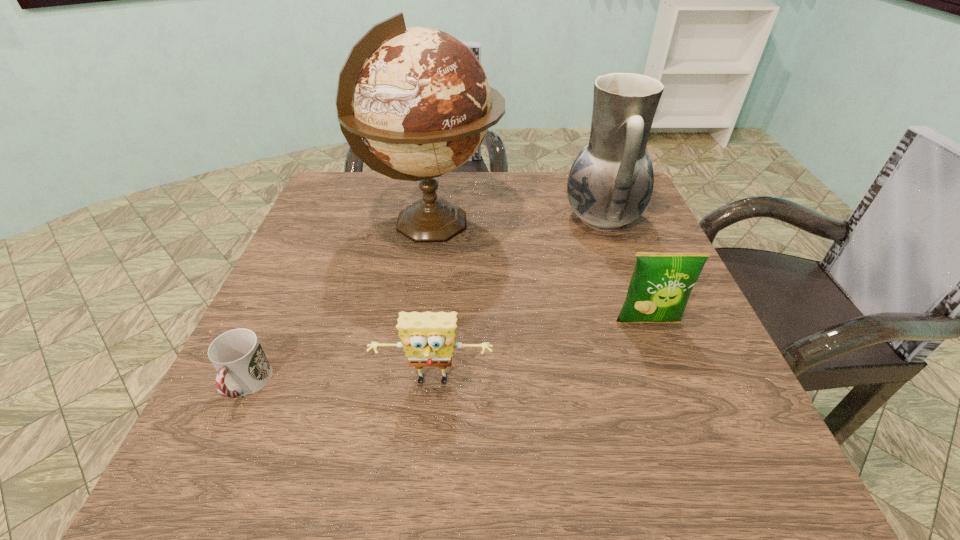
At what (x,y) coordinates should I click in order to perform the action: click on vacant space located on the front-facing side of the pitcher. Please return your answer as a coordinate pair (x, y). Looking at the image, I should click on (491, 218).

Locate an element on the screen. vacant region located 0.200m on the front-facing side of the crisp (potato chip) is located at coordinates (689, 431).

The image size is (960, 540). Find the location of `free space located 0.050m on the face of the sponge`. free space located 0.050m on the face of the sponge is located at coordinates point(429,427).

Where is `free space located 0.090m on the handle side of the cup`? The height and width of the screenshot is (540, 960). free space located 0.090m on the handle side of the cup is located at coordinates (208, 469).

The width and height of the screenshot is (960, 540). Find the location of `globe present at the far edge`. globe present at the far edge is located at coordinates (419, 98).

Image resolution: width=960 pixels, height=540 pixels. Find the location of `pitcher that is at the far edge`. pitcher that is at the far edge is located at coordinates (610, 184).

Locate an element on the screen. The image size is (960, 540). globe positioned at the left edge is located at coordinates (419, 98).

What are the coordinates of `cup that is at the left edge` in the screenshot? It's located at (237, 355).

Image resolution: width=960 pixels, height=540 pixels. I want to click on pitcher that is at the right edge, so click(610, 184).

You are a GUI agent. You are given a task and a screenshot of the screen. Output one action in this format:
    pyautogui.click(x=<x>, y=<y>)
    Task: Click on the crisp (potato chip) located in the right edge section of the desktop
    This screenshot has height=540, width=960.
    Given the screenshot: What is the action you would take?
    pyautogui.click(x=661, y=283)